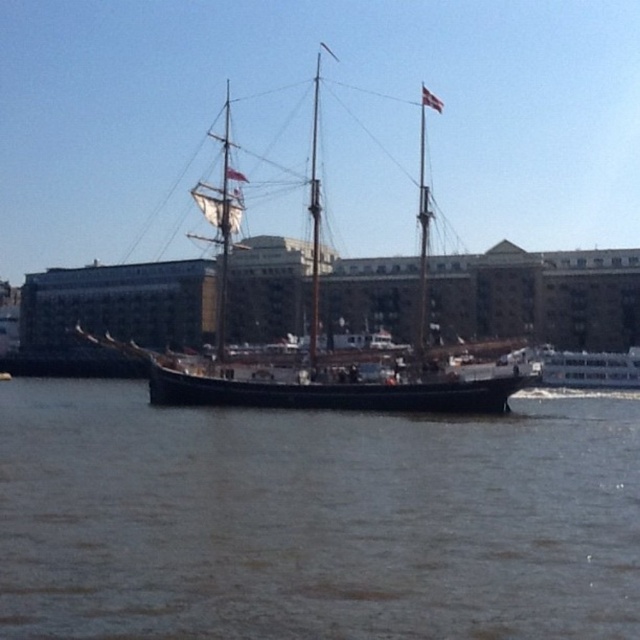
You are standing on the waterfront and see the wooden ship at center. If you want to walk directly towards it, which direction should you face?

Since the wooden ship at center is located at point [307,376] in the image, you should face towards the center of the image to walk directly towards it.

You are standing on the deck of the historic sailing ship and see the point marked at coordinates point (316,518). What is located at that point?

The point marked at coordinates point (316,518) is brown water at center.